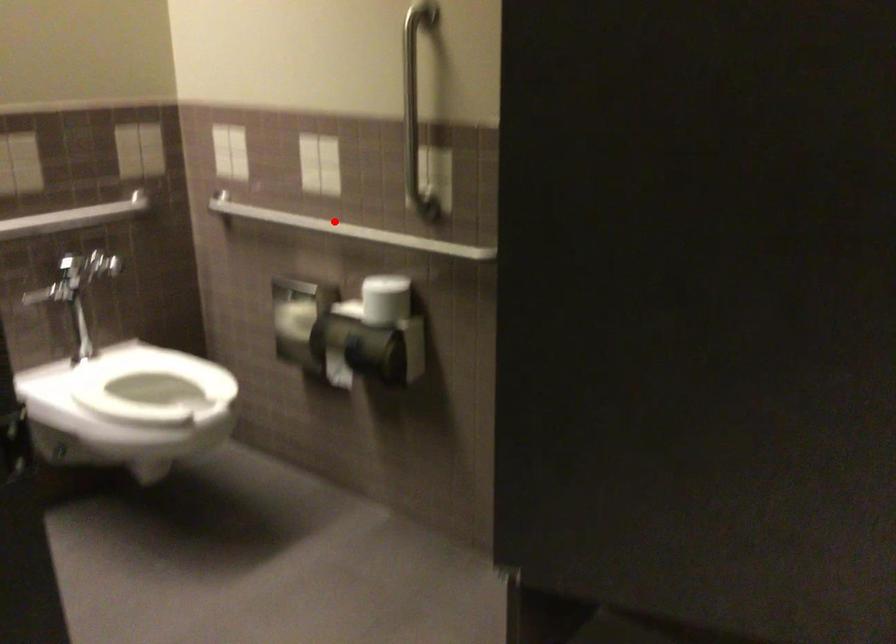
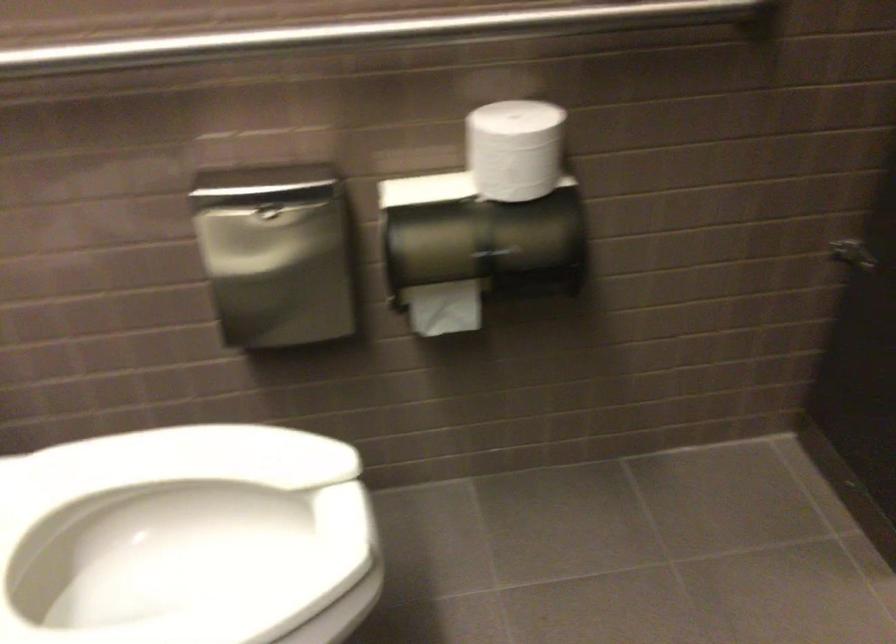
Question: I am providing you with two images of the same scene from different viewpoints. Image1 has a red point marked. In image2, the corresponding 3D location appears at what relative position? Reply with the corresponding letter.

Choices:
 (A) Closer
 (B) Farther

Answer: (A)